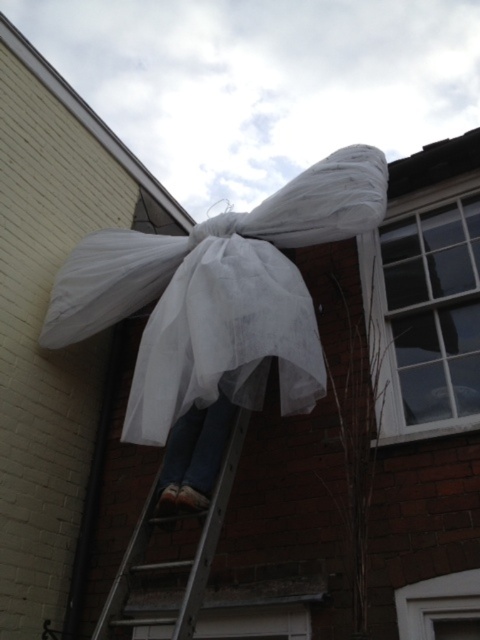
Question: Is white sheer fabric at upper center smaller than silver metallic ladder at center?

Choices:
 (A) yes
 (B) no

Answer: (B)

Question: Is white sheer fabric at upper center to the left of silver metallic ladder at center from the viewer's perspective?

Choices:
 (A) no
 (B) yes

Answer: (A)

Question: Is white sheer fabric at upper center thinner than silver metallic ladder at center?

Choices:
 (A) yes
 (B) no

Answer: (B)

Question: Which point is closer to the camera taking this photo?

Choices:
 (A) (83, 328)
 (B) (192, 612)

Answer: (B)

Question: Which point is farther from the camera taking this photo?

Choices:
 (A) (365, 154)
 (B) (194, 573)

Answer: (A)